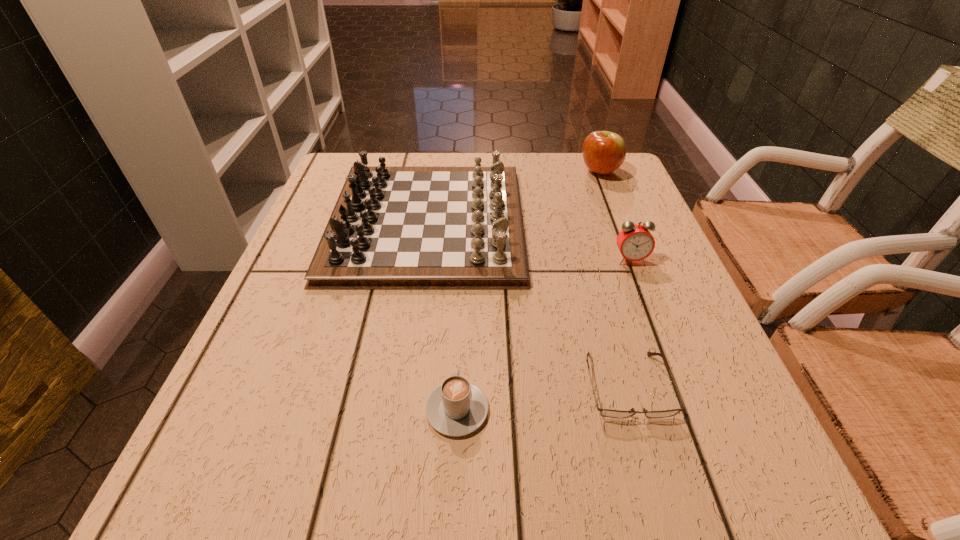
The image size is (960, 540). Identify the location of blank space located to the right of the second shortest object. (460, 344).

Find the location of a particular element. The image size is (960, 540). vacant area situated on the front-facing side of the shortest object is located at coordinates (661, 507).

I want to click on chessboard situated at the far edge, so click(393, 227).

This screenshot has width=960, height=540. I want to click on apple that is positioned at the far edge, so click(x=603, y=152).

I want to click on object that is at the left edge, so click(x=393, y=227).

The height and width of the screenshot is (540, 960). Find the location of `apple positioned at the right edge`. apple positioned at the right edge is located at coordinates (603, 152).

In order to click on alarm clock at the right edge in this screenshot , I will do `click(635, 242)`.

At what (x,y) coordinates should I click in order to perform the action: click on spectacles positioned at the right edge. Please return your answer as a coordinate pair (x, y). Looking at the image, I should click on (609, 413).

I want to click on object present at the far left corner, so (x=393, y=227).

You are a GUI agent. You are given a task and a screenshot of the screen. Output one action in this format:
    pyautogui.click(x=<x>, y=<y>)
    Task: Click on the object positioned at the far right corner
    The width and height of the screenshot is (960, 540).
    Given the screenshot: What is the action you would take?
    pyautogui.click(x=603, y=152)